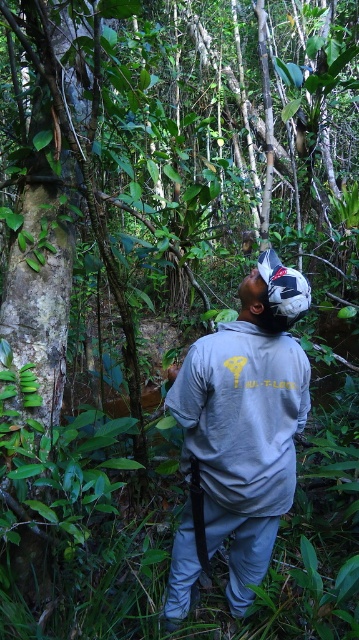
You are a hiker trying to identify clothing items on a person in the forest. Which clothing item is positioned more to the left between the gray fabric shirt at center and the gray matte sweatshirt at center?

The gray fabric shirt at center is positioned to the left of the gray matte sweatshirt at center.

You are navigating through the forest and need to determine which of the two points, point (278, 324) or point (255, 362), is nearer to you. Based on the scene, which point is closer?

Point (278, 324) is closer to the viewer than point (255, 362).